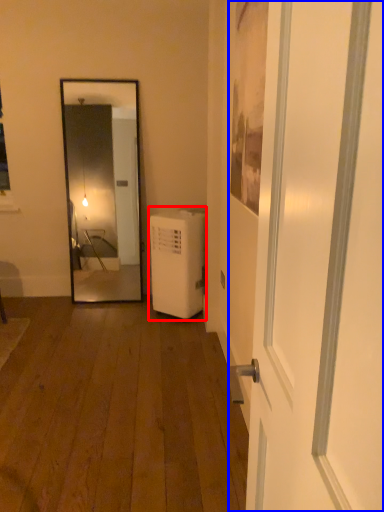
Question: Which of the following is the closest to the observer, dish washer (highlighted by a red box) or door (highlighted by a blue box)?

Choices:
 (A) dish washer
 (B) door

Answer: (B)